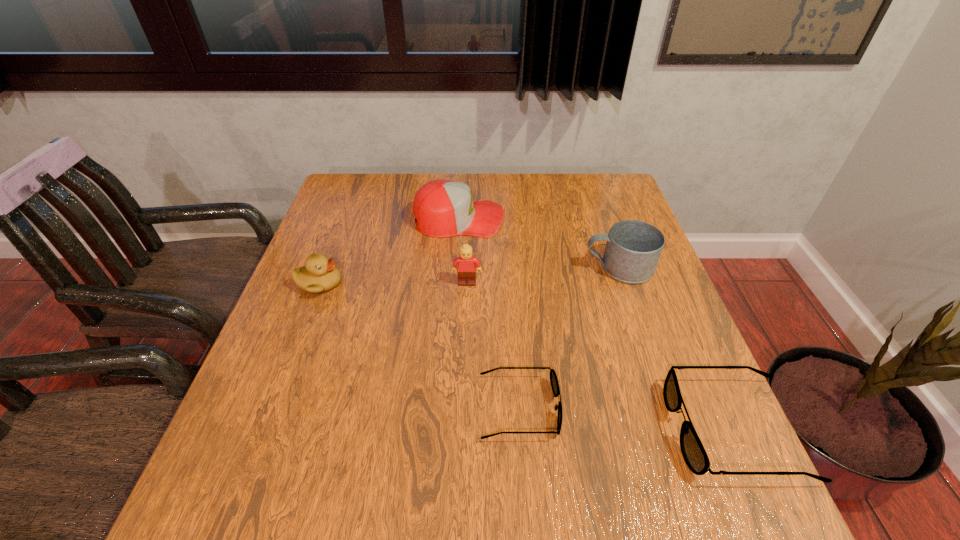
Locate an element on the screen. The image size is (960, 540). spectacles located in the right edge section of the desktop is located at coordinates (693, 451).

The width and height of the screenshot is (960, 540). I want to click on mug that is at the right edge, so click(633, 248).

Image resolution: width=960 pixels, height=540 pixels. In order to click on object that is at the near right corner in this screenshot , I will do `click(693, 451)`.

This screenshot has width=960, height=540. In the image, there is a desktop. In order to click on vacant space at the far edge in this screenshot , I will do `click(511, 179)`.

Where is `free space at the left edge of the desktop`? free space at the left edge of the desktop is located at coordinates (338, 251).

Find the location of `blank space at the right edge`. blank space at the right edge is located at coordinates (699, 366).

Image resolution: width=960 pixels, height=540 pixels. What are the coordinates of `vacant space at the far left corner` in the screenshot? It's located at (354, 180).

The height and width of the screenshot is (540, 960). What are the coordinates of `vacant space at the near right corner` in the screenshot? It's located at (657, 431).

Locate an element on the screen. free space between the Lego and the shortest object is located at coordinates point(493,346).

Where is `vacant space that is in between the right spectacles and the Lego`? Image resolution: width=960 pixels, height=540 pixels. vacant space that is in between the right spectacles and the Lego is located at coordinates (600, 356).